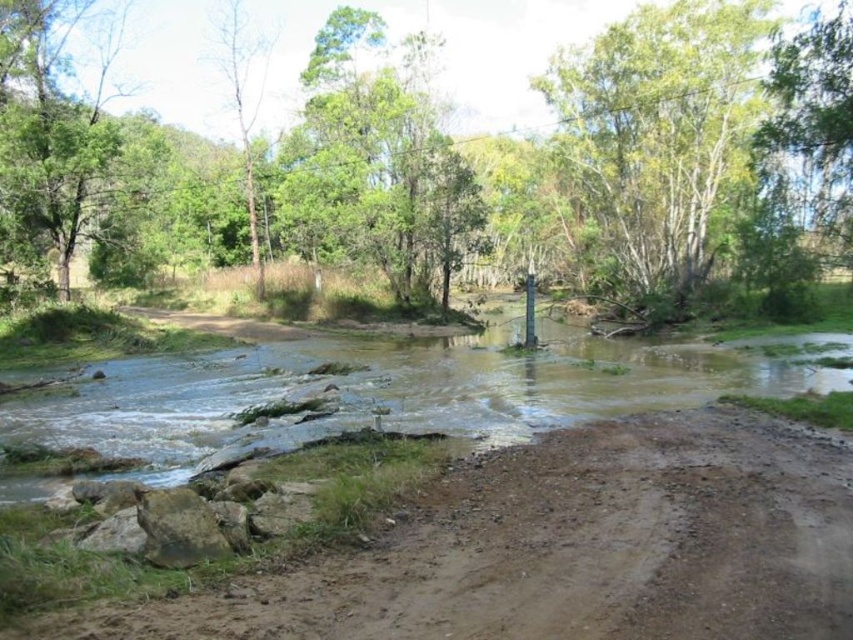
Question: Based on their relative distances, which object is farther from the brown dirt track at lower left?

Choices:
 (A) green leafy tree at upper center
 (B) brown muddy stream at center
 (C) green leafy tree at center
 (D) green leafy tree at upper left

Answer: (A)

Question: Which object is the closest to the brown muddy stream at center?

Choices:
 (A) green leafy tree at center
 (B) green leafy tree at upper center
 (C) brown dirt track at lower left
 (D) green leafy tree at upper left

Answer: (C)

Question: Among these objects, which one is farthest from the camera?

Choices:
 (A) brown dirt track at lower left
 (B) green leafy tree at upper left

Answer: (B)

Question: Where is brown muddy stream at center located in relation to green leafy tree at upper center in the image?

Choices:
 (A) above
 (B) below

Answer: (B)

Question: Can you confirm if brown dirt track at lower left is positioned to the left of green leafy tree at upper left?

Choices:
 (A) no
 (B) yes

Answer: (A)

Question: Considering the relative positions of brown muddy stream at center and green leafy tree at upper left in the image provided, where is brown muddy stream at center located with respect to green leafy tree at upper left?

Choices:
 (A) above
 (B) below

Answer: (B)